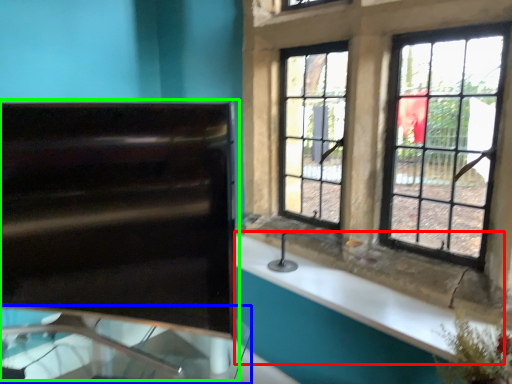
Question: Which object is positioned closest to counter top (highlighted by a red box)? Select from glass table (highlighted by a blue box) and sink (highlighted by a green box).

Choices:
 (A) glass table
 (B) sink

Answer: (A)